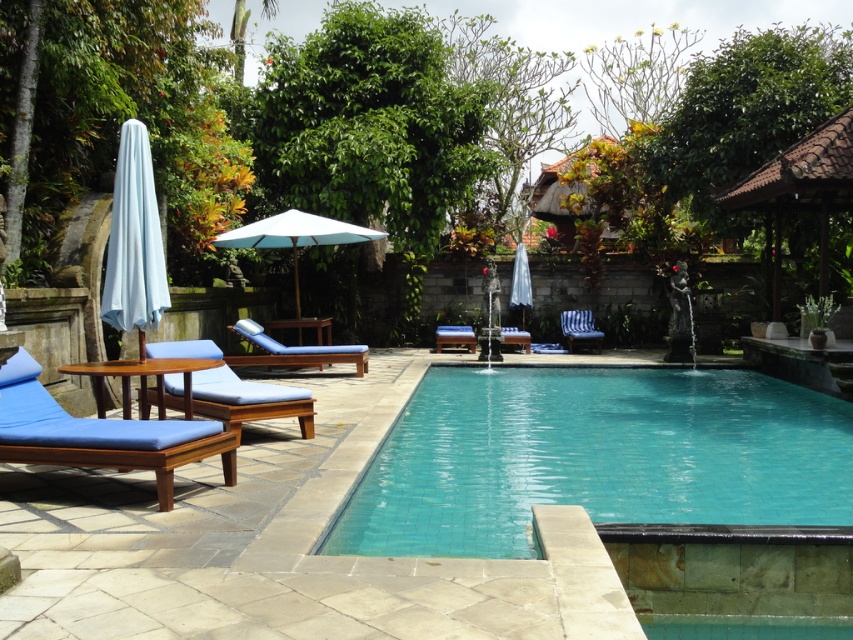
Question: Among these objects, which one is nearest to the camera?

Choices:
 (A) blue wood chaise lounge at center
 (B) white fabric umbrella at left
 (C) blue fabric chair at lower left

Answer: (C)

Question: Which of the following is the farthest from the observer?

Choices:
 (A) white fabric umbrella at center
 (B) white wood umbrella at center
 (C) blue fabric lounge chair at left
 (D) blue fabric lounge chair at center

Answer: (A)

Question: Is white wood umbrella at center to the left of blue striped fabric beach chair at center from the viewer's perspective?

Choices:
 (A) no
 (B) yes

Answer: (B)

Question: Which point is farther to the camera?

Choices:
 (A) green leafy tree at upper center
 (B) blue fabric chair at lower left
 (C) blue fabric lounge chair at center

Answer: (C)

Question: Is white fabric umbrella at left above blue wood chaise lounge at center?

Choices:
 (A) yes
 (B) no

Answer: (A)

Question: Can you confirm if teal tile swimming pool at center is positioned to the right of blue striped fabric beach chair at center?

Choices:
 (A) yes
 (B) no

Answer: (A)